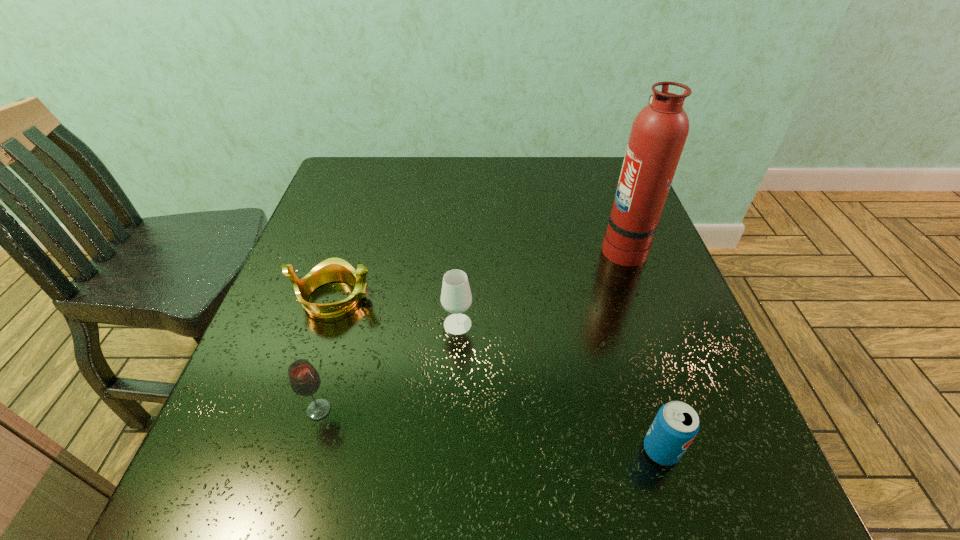
You are a GUI agent. You are given a task and a screenshot of the screen. Output one action in this format:
    pyautogui.click(x=<x>, y=<y>)
    Task: Click on the free spot between the nearest object and the farther glass drink container
    This screenshot has height=540, width=960.
    Given the screenshot: What is the action you would take?
    pyautogui.click(x=560, y=387)

Find the location of a particular element. The height and width of the screenshot is (540, 960). free space between the tiara and the nearest object is located at coordinates click(497, 374).

Identify the location of blank region between the farthest object and the farther glass drink container. The width and height of the screenshot is (960, 540). (540, 286).

You are a GUI agent. You are given a task and a screenshot of the screen. Output one action in this format:
    pyautogui.click(x=<x>, y=<y>)
    Task: Click on the free spot between the tiara and the left glass drink container
    
    Given the screenshot: What is the action you would take?
    pyautogui.click(x=326, y=354)

Find the location of `free space between the nearest object and the fourth farthest object`. free space between the nearest object and the fourth farthest object is located at coordinates (490, 430).

Where is `free spot between the tiara and the soda can`? free spot between the tiara and the soda can is located at coordinates (497, 374).

Where is `free point between the farther glass drink container and the fire extinguisher`? This screenshot has height=540, width=960. free point between the farther glass drink container and the fire extinguisher is located at coordinates (540, 286).

Identify the location of object that is the closest to the farther glass drink container. (333, 269).

Find the location of `object that is the closest one to the nearer glass drink container`. object that is the closest one to the nearer glass drink container is located at coordinates (333, 269).

I want to click on vacant space that satisfies the following two spatial constraints: 1. on the label side of the farthest object; 2. on the front side of the nearer glass drink container, so click(682, 410).